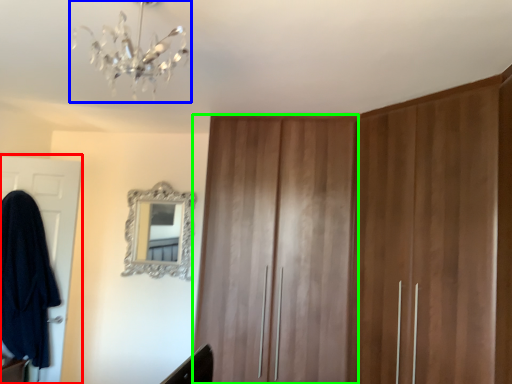
Question: Which object is the farthest from door (highlighted by a red box)? Choose among these: light fixture (highlighted by a blue box) or locker (highlighted by a green box).

Choices:
 (A) light fixture
 (B) locker

Answer: (A)